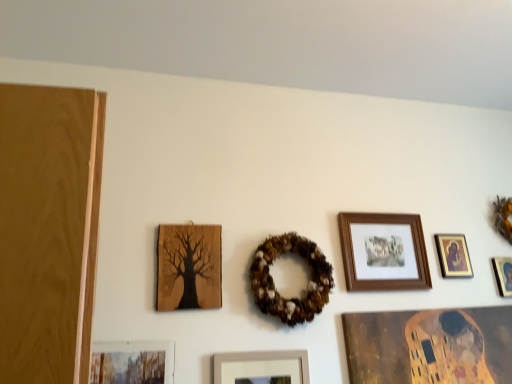
Question: Can matte white picture frame at center, which appears as the 4th picture frame when viewed from the right, be found inside orange fabric wreath at upper right, which is the 1th decor in right-to-left order?

Choices:
 (A) no
 (B) yes

Answer: (A)

Question: Can you confirm if orange fabric wreath at upper right, which is the 1th decor in right-to-left order, is thinner than matte white picture frame at center, which appears as the 4th picture frame when viewed from the right?

Choices:
 (A) yes
 (B) no

Answer: (B)

Question: From the image's perspective, would you say orange fabric wreath at upper right, which appears as the first decor when viewed from the back, is shown under matte white picture frame at center, which is the 3th picture frame from left to right?

Choices:
 (A) no
 (B) yes

Answer: (A)

Question: Can you confirm if orange fabric wreath at upper right, which is counted as the 2th decor, starting from the front, is smaller than matte white picture frame at center, which is the 3th picture frame from left to right?

Choices:
 (A) yes
 (B) no

Answer: (B)

Question: Can you confirm if orange fabric wreath at upper right, which is the 1th decor in right-to-left order, is positioned to the right of matte white picture frame at center, which is the 3th picture frame from left to right?

Choices:
 (A) yes
 (B) no

Answer: (A)

Question: Is orange fabric wreath at upper right, which appears as the 2th decor when viewed from the left, oriented away from matte white picture frame at center, which is the 3th picture frame from left to right?

Choices:
 (A) yes
 (B) no

Answer: (B)

Question: Can you confirm if matte black picture frame at upper right, the 1th picture frame positioned from the right, is shorter than matte white picture frame at center, which appears as the 4th picture frame when viewed from the right?

Choices:
 (A) yes
 (B) no

Answer: (A)

Question: Is matte black picture frame at upper right, the 6th picture frame from the left, at the left side of matte white picture frame at center, which is the 3th picture frame from left to right?

Choices:
 (A) yes
 (B) no

Answer: (B)

Question: From the image's perspective, is matte black picture frame at upper right, the 1th picture frame positioned from the right, beneath matte white picture frame at center, which is the 3th picture frame from left to right?

Choices:
 (A) no
 (B) yes

Answer: (A)

Question: Can matte white picture frame at center, which appears as the 4th picture frame when viewed from the right, be found inside matte black picture frame at upper right, the 6th picture frame from the left?

Choices:
 (A) no
 (B) yes

Answer: (A)

Question: Is matte black picture frame at upper right, the 6th picture frame from the left, not inside matte white picture frame at center, which appears as the 4th picture frame when viewed from the right?

Choices:
 (A) no
 (B) yes

Answer: (B)

Question: Can you confirm if matte black picture frame at upper right, the 1th picture frame positioned from the right, is thinner than matte white picture frame at center, which is the 3th picture frame from left to right?

Choices:
 (A) no
 (B) yes

Answer: (B)

Question: Does matte black picture frame at upper right, the 6th picture frame from the left, have a greater width compared to brown textured wreath at center, the 1th decor viewed from the left?

Choices:
 (A) no
 (B) yes

Answer: (A)